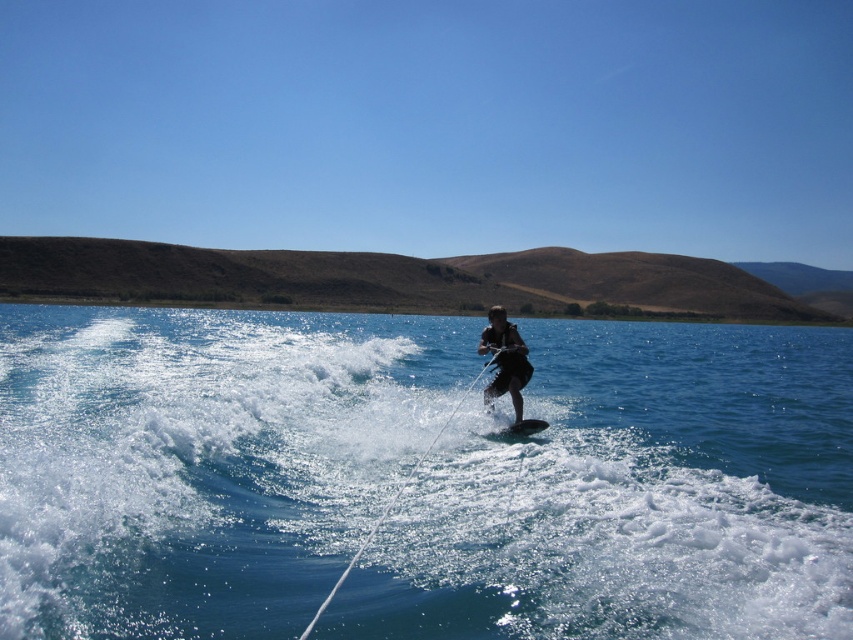
You are a photographer trying to capture the skier in the dark blue wetsuit at center. To get a clear shot of the skier, should you focus on the clear blue water at center first or adjust your focus to something else?

The clear blue water at center is in front of the dark blue wetsuit at center, so you should adjust your focus to the dark blue wetsuit at center instead of the clear blue water at center to capture the skier clearly.

You are a water safety officer assessing the scene. The safety protocol requires that the distance between the skier and the water surface must be at least 50 feet for safety. Is the current distance between the clear blue water at center and dark blue wetsuit at center compliant with the protocol?

The clear blue water at center is 70.04 feet from the dark blue wetsuit at center. Since 70.04 feet exceeds the required 50 feet, the distance is compliant with the safety protocol.